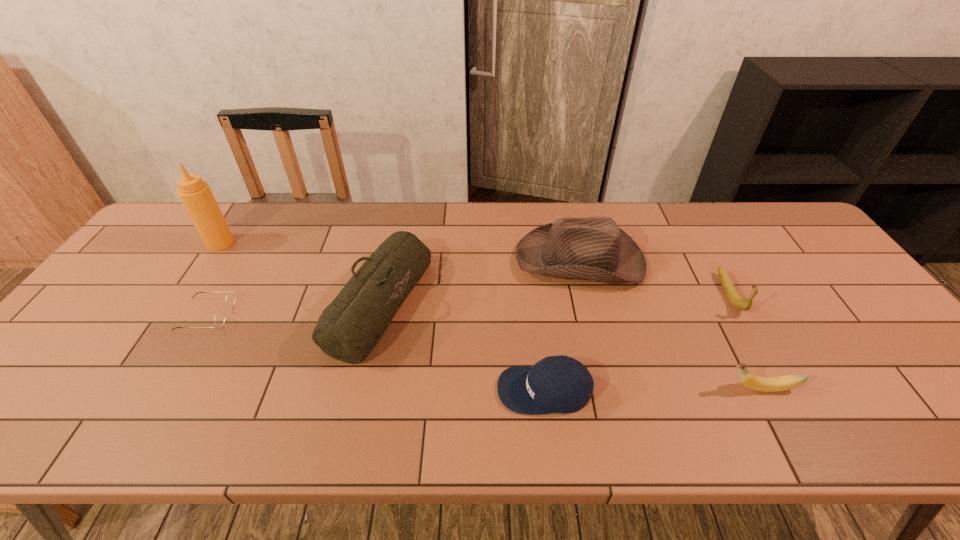
Locate an element on the screen. This screenshot has height=540, width=960. empty space that is in between the shortest object and the farther banana is located at coordinates (468, 305).

The height and width of the screenshot is (540, 960). Identify the location of free spot between the condiment and the shortest object. (213, 279).

You are a GUI agent. You are given a task and a screenshot of the screen. Output one action in this format:
    pyautogui.click(x=<x>, y=<y>)
    Task: Click on the free space between the shorter banana and the condiment
    This screenshot has height=540, width=960.
    Given the screenshot: What is the action you would take?
    pyautogui.click(x=491, y=315)

Identify the location of free space between the baseball cap and the fedora. This screenshot has width=960, height=540. (563, 326).

I want to click on object that is the sixth nearest to the shortest object, so click(x=737, y=301).

Select which object is the fourth closest to the farther banana. Please provide its 2D coordinates. Your answer should be formatted as a tuple, i.e. [(x, y)], where the tuple contains the x and y coordinates of a point satisfying the conditions above.

[(348, 329)]